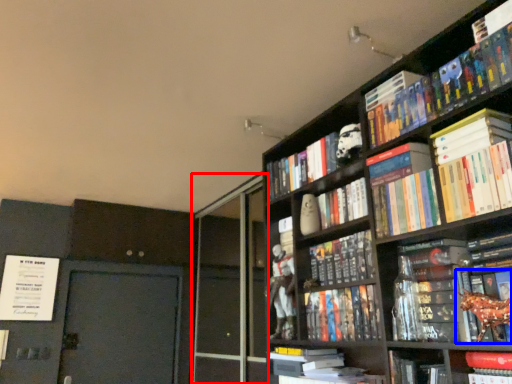
Question: Which object appears farthest to the camera in this image, screen door (highlighted by a red box) or book (highlighted by a blue box)?

Choices:
 (A) screen door
 (B) book

Answer: (A)